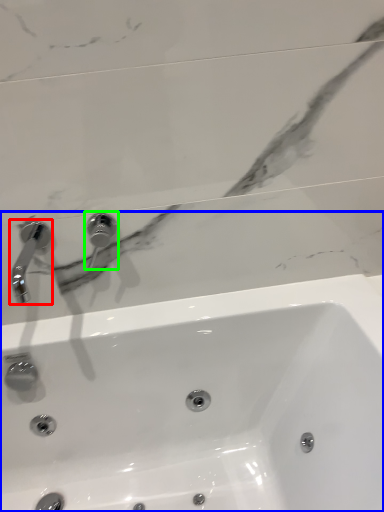
Question: Which object is the farthest from tap (highlighted by a red box)? Choose among these: sink (highlighted by a blue box) or tap (highlighted by a green box).

Choices:
 (A) sink
 (B) tap

Answer: (A)